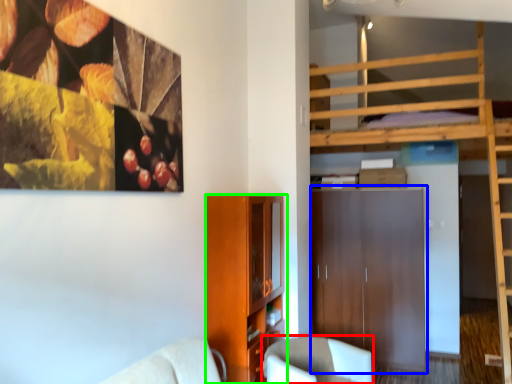
Question: Which object is the closest to the chair (highlighted by a red box)? Choose among these: dresser (highlighted by a blue box) or cabinetry (highlighted by a green box).

Choices:
 (A) dresser
 (B) cabinetry

Answer: (B)